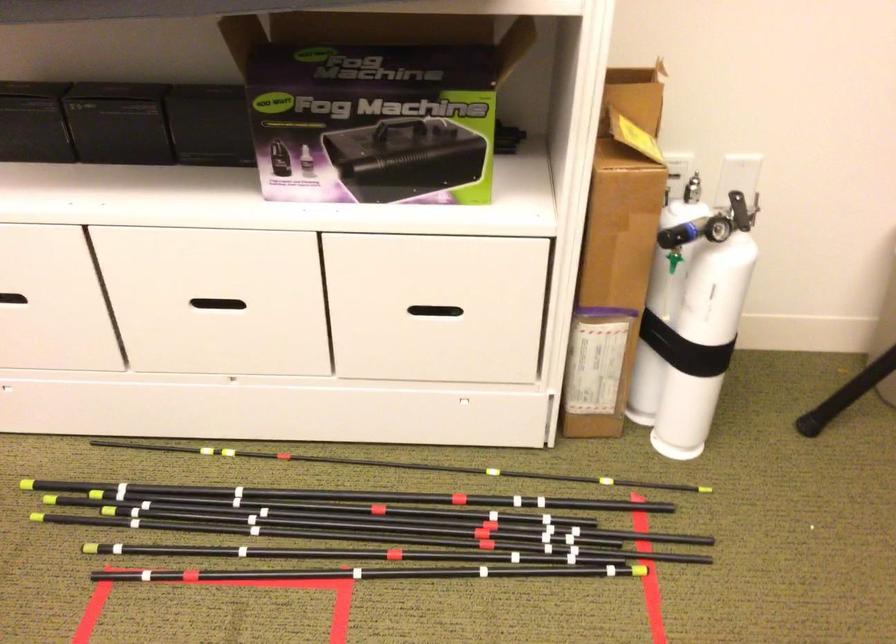
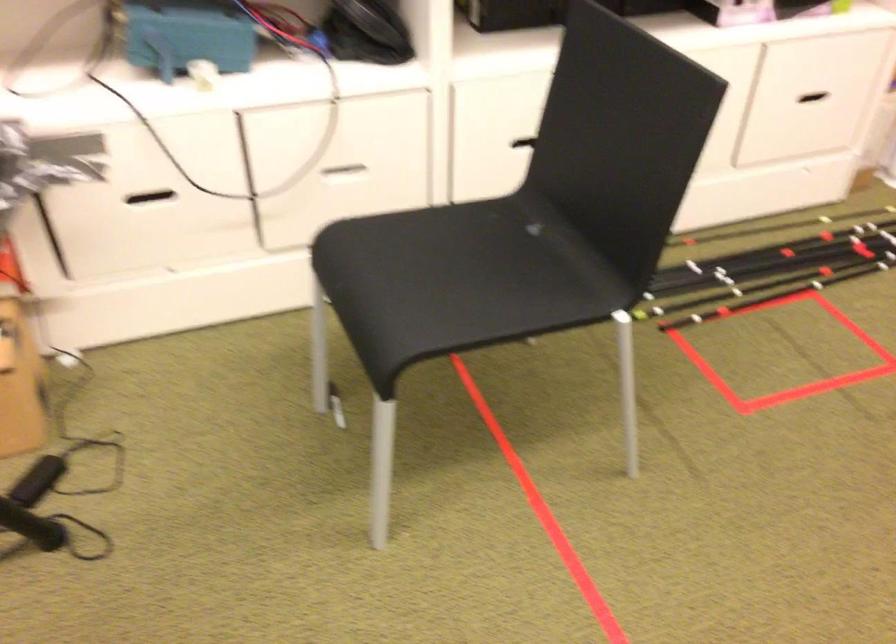
Question: Which direction would the cameraman need to move to produce the second image? Reply with the corresponding letter.

Choices:
 (A) Left
 (B) Right
 (C) Forward
 (D) Backward

Answer: (A)